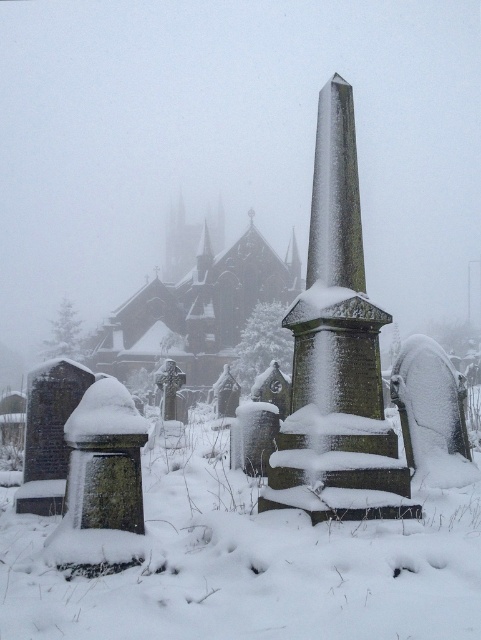
You are standing in the snow at the edge of the graveyard. You see the dark brown stone church at center and the green mossy gravestone at lower left. Which one is closer to your right side?

The green mossy gravestone at lower left is closer to your right side because the dark brown stone church at center is to the left of it, meaning the gravestone is positioned to the right relative to the church.

You are standing in the snow covered graveyard and want to find the dark brown stone church at center. According to the coordinates given, where should you look?

You should look at point 0.412 on the y axis and 0.484 on the x axis to find the dark brown stone church at center.